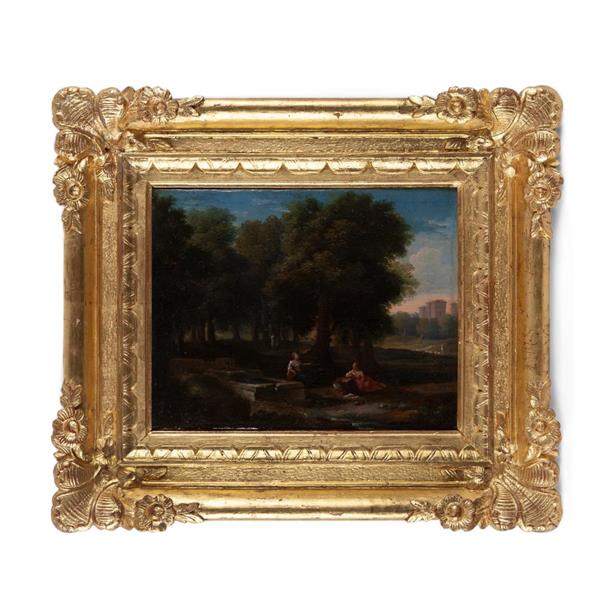
In order to click on middle of bottom edge of frame in this screenshot , I will do `click(293, 521)`.